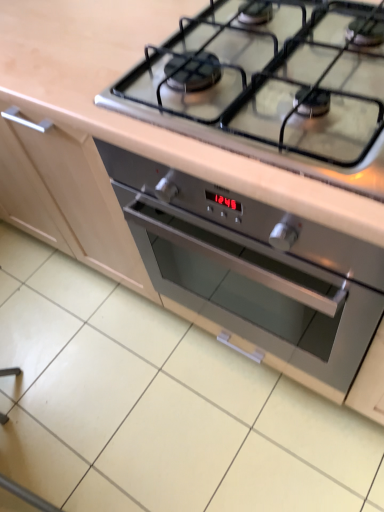
Question: In the image, is stainless steel oven at center positioned in front of or behind stainless steel gas stove at upper center?

Choices:
 (A) front
 (B) behind

Answer: (B)

Question: In terms of height, does stainless steel oven at center look taller or shorter compared to stainless steel gas stove at upper center?

Choices:
 (A) short
 (B) tall

Answer: (B)

Question: Is stainless steel oven at center inside or outside of stainless steel gas stove at upper center?

Choices:
 (A) inside
 (B) outside

Answer: (B)

Question: From the image's perspective, is stainless steel gas stove at upper center above or below stainless steel oven at center?

Choices:
 (A) above
 (B) below

Answer: (A)

Question: Considering their positions, is stainless steel gas stove at upper center located in front of or behind stainless steel oven at center?

Choices:
 (A) front
 (B) behind

Answer: (A)

Question: Is point (332, 163) closer or farther from the camera than point (266, 234)?

Choices:
 (A) farther
 (B) closer

Answer: (B)

Question: Looking at the image, does stainless steel gas stove at upper center seem bigger or smaller compared to stainless steel oven at center?

Choices:
 (A) big
 (B) small

Answer: (B)